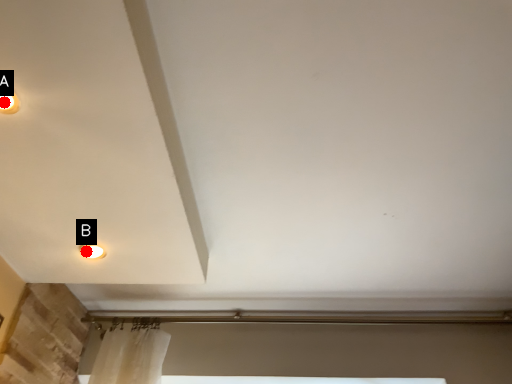
Question: Two points are circled on the image, labeled by A and B beside each circle. Which point appears farthest from the camera in this image?

Choices:
 (A) A is further
 (B) B is further

Answer: (B)